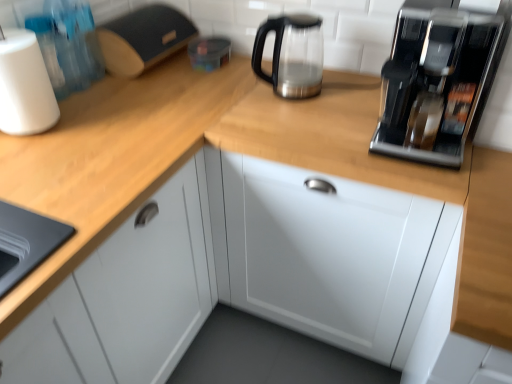
Where is `empty space that is ontop of wooden at left (from a real-world perspective)`? This screenshot has width=512, height=384. empty space that is ontop of wooden at left (from a real-world perspective) is located at coordinates (112, 121).